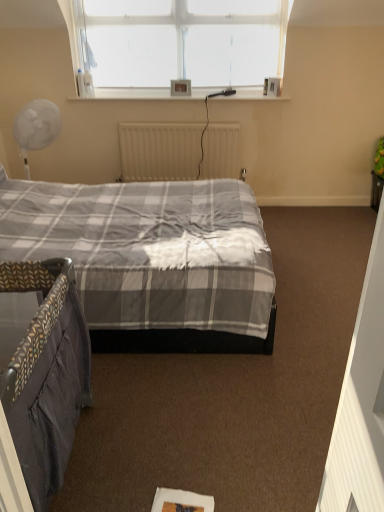
Question: Does white matte radiator at center contain matte plastic picture frame at upper center?

Choices:
 (A) yes
 (B) no

Answer: (B)

Question: From a real-world perspective, is white matte radiator at center positioned under matte plastic picture frame at upper center based on gravity?

Choices:
 (A) no
 (B) yes

Answer: (B)

Question: Is white matte radiator at center shorter than matte plastic picture frame at upper center?

Choices:
 (A) no
 (B) yes

Answer: (A)

Question: Can you confirm if white matte radiator at center is thinner than matte plastic picture frame at upper center?

Choices:
 (A) yes
 (B) no

Answer: (B)

Question: Can you confirm if white matte radiator at center is bigger than matte plastic picture frame at upper center?

Choices:
 (A) no
 (B) yes

Answer: (B)

Question: Is white matte radiator at center wider than matte plastic picture frame at upper center?

Choices:
 (A) no
 (B) yes

Answer: (B)

Question: Does white matte radiator at center touch dark grey fabric crib at lower left?

Choices:
 (A) no
 (B) yes

Answer: (A)

Question: Does white matte radiator at center lie in front of dark grey fabric crib at lower left?

Choices:
 (A) yes
 (B) no

Answer: (B)

Question: Is dark grey fabric crib at lower left completely or partially inside white matte radiator at center?

Choices:
 (A) yes
 (B) no

Answer: (B)

Question: Are white matte radiator at center and dark grey fabric crib at lower left located far from each other?

Choices:
 (A) yes
 (B) no

Answer: (A)

Question: From a real-world perspective, does white matte radiator at center stand above dark grey fabric crib at lower left?

Choices:
 (A) yes
 (B) no

Answer: (A)

Question: Is white matte radiator at center turned away from dark grey fabric crib at lower left?

Choices:
 (A) no
 (B) yes

Answer: (A)

Question: Can you confirm if dark grey fabric crib at lower left is bigger than white matte radiator at center?

Choices:
 (A) yes
 (B) no

Answer: (A)